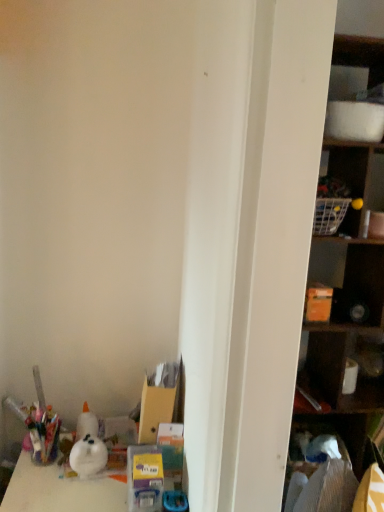
Question: Would you say matte black cabinet at right is to the left or to the right of wooden shelf at right in the picture?

Choices:
 (A) left
 (B) right

Answer: (A)

Question: Is point click(x=311, y=389) positioned closer to the camera than point click(x=370, y=66)?

Choices:
 (A) closer
 (B) farther

Answer: (B)

Question: From a real-world perspective, is matte black cabinet at right positioned above or below wooden shelf at right?

Choices:
 (A) above
 (B) below

Answer: (B)

Question: From the image's perspective, is wooden shelf at right above or below matte black cabinet at right?

Choices:
 (A) below
 (B) above

Answer: (B)

Question: Considering the positions of wooden shelf at right and matte black cabinet at right in the image, is wooden shelf at right wider or thinner than matte black cabinet at right?

Choices:
 (A) wide
 (B) thin

Answer: (A)

Question: In the image, is wooden shelf at right positioned in front of or behind matte black cabinet at right?

Choices:
 (A) front
 (B) behind

Answer: (A)

Question: Would you say wooden shelf at right is inside or outside matte black cabinet at right?

Choices:
 (A) inside
 (B) outside

Answer: (B)